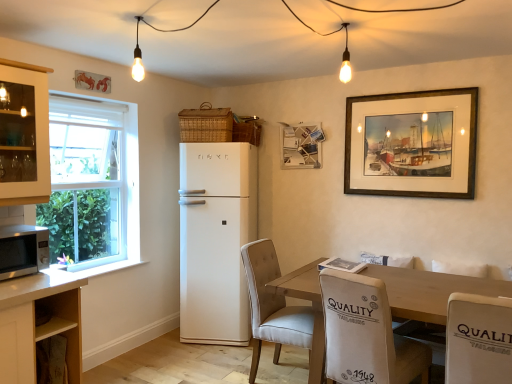
Question: From the image's perspective, is beige fabric chair at lower right, the 2th chair when ordered from right to left, located beneath beige fabric chair at center, which is the first chair in left-to-right order?

Choices:
 (A) yes
 (B) no

Answer: (B)

Question: Is beige fabric chair at lower right, the 2th chair when ordered from right to left, bigger than beige fabric chair at center, marked as the third chair in a right-to-left arrangement?

Choices:
 (A) yes
 (B) no

Answer: (B)

Question: Is beige fabric chair at lower right, the 2th chair when ordered from right to left, thinner than beige fabric chair at center, marked as the third chair in a right-to-left arrangement?

Choices:
 (A) yes
 (B) no

Answer: (A)

Question: Does beige fabric chair at lower right, which is the second chair from left to right, turn towards beige fabric chair at center, which is the first chair in left-to-right order?

Choices:
 (A) yes
 (B) no

Answer: (B)

Question: Is beige fabric chair at lower right, which is the second chair from left to right, in contact with beige fabric chair at center, marked as the third chair in a right-to-left arrangement?

Choices:
 (A) yes
 (B) no

Answer: (B)

Question: Does beige fabric chair at lower right, which is the second chair from left to right, have a smaller size compared to beige fabric chair at center, marked as the third chair in a right-to-left arrangement?

Choices:
 (A) yes
 (B) no

Answer: (A)

Question: Does wooden framed painting at upper right, which is the first picture frame in front-to-back order, have a greater width compared to white fabric chair at lower right, the 1th chair positioned from the right?

Choices:
 (A) no
 (B) yes

Answer: (A)

Question: Considering the relative positions of wooden framed painting at upper right, which appears as the first picture frame when viewed from the right, and white fabric chair at lower right, which is counted as the 3th chair, starting from the left, in the image provided, is wooden framed painting at upper right, which appears as the first picture frame when viewed from the right, to the right of white fabric chair at lower right, which is counted as the 3th chair, starting from the left, from the viewer's perspective?

Choices:
 (A) no
 (B) yes

Answer: (B)

Question: From a real-world perspective, is wooden framed painting at upper right, which is the second picture frame in left-to-right order, on white fabric chair at lower right, which is counted as the 3th chair, starting from the left?

Choices:
 (A) no
 (B) yes

Answer: (B)

Question: Is wooden framed painting at upper right, which is the second picture frame in left-to-right order, aimed at white fabric chair at lower right, the 1th chair positioned from the right?

Choices:
 (A) no
 (B) yes

Answer: (A)

Question: Is wooden framed painting at upper right, arranged as the second picture frame when viewed from the back, not inside white fabric chair at lower right, which is counted as the 3th chair, starting from the left?

Choices:
 (A) no
 (B) yes

Answer: (B)

Question: Is wooden framed painting at upper right, which appears as the first picture frame when viewed from the right, not near white fabric chair at lower right, the 1th chair positioned from the right?

Choices:
 (A) no
 (B) yes

Answer: (B)

Question: Does wooden framed painting at upper right, which is the second picture frame in left-to-right order, have a larger size compared to wooden picture frame at upper center, which is the second picture frame from right to left?

Choices:
 (A) yes
 (B) no

Answer: (A)